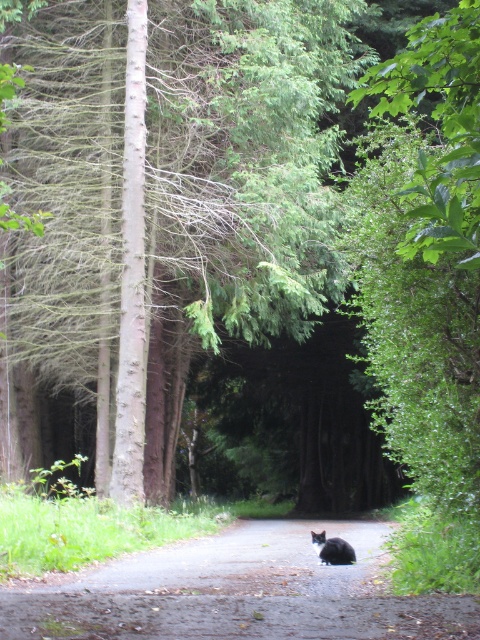
You are a hiker walking along the dirt road at center in the forest. You notice the brown rough tree at center ahead of you. Which one is taller?

The brown rough tree at center is taller than the dirt road at center.

You are a hiker walking along the narrow dirt path in the forest. You see two points marked on the ground ahead of you. The first point is at coordinate point [39,24], and the second point is at coordinate point [364,563]. Which point is closer to you as you walk along the path?

Point [39,24] is closer to you because it is further to the viewer than point [364,563], meaning it is nearer along your path.